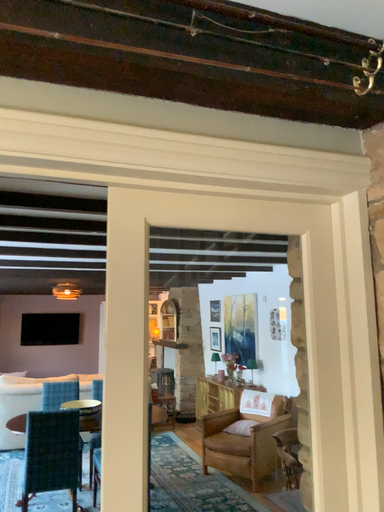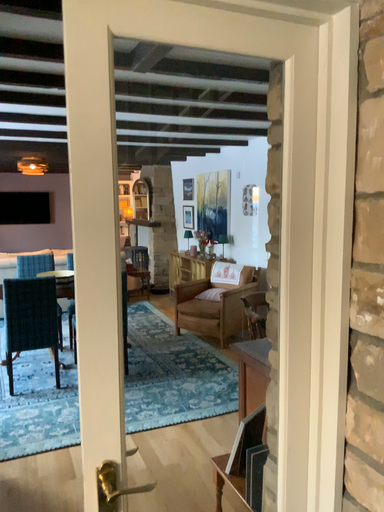
Question: Which way did the camera rotate in the video?

Choices:
 (A) rotated downward
 (B) rotated upward

Answer: (A)